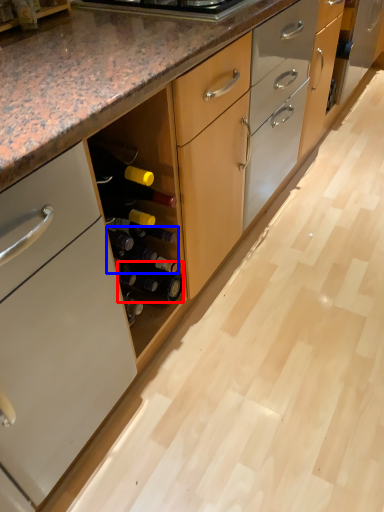
Question: Which of the following is the closest to the observer, beer bottle (highlighted by a red box) or beer bottle (highlighted by a blue box)?

Choices:
 (A) beer bottle
 (B) beer bottle

Answer: (B)